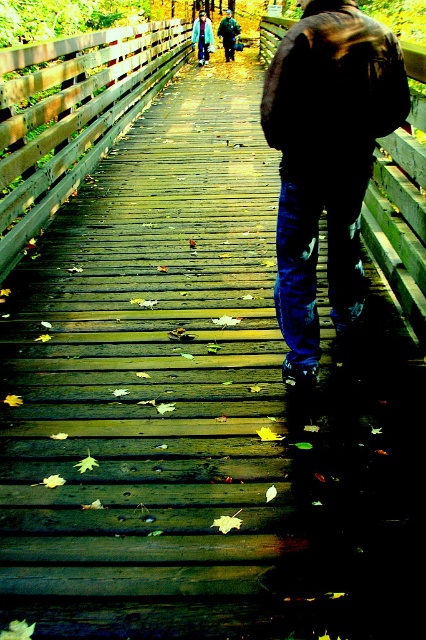
Question: Can you confirm if dark brown leather jacket at center is wider than brushed metal jacket at upper center?

Choices:
 (A) yes
 (B) no

Answer: (B)

Question: Which point is farther to the camera?

Choices:
 (A) brushed metal jacket at upper center
 (B) light blue denim jacket at upper center

Answer: (A)

Question: Which point is closer to the camera?

Choices:
 (A) (310, 182)
 (B) (221, 20)
 (C) (199, 35)

Answer: (A)

Question: Among these objects, which one is nearest to the camera?

Choices:
 (A) brushed metal jacket at upper center
 (B) light blue denim jacket at upper center
 (C) dark brown leather jacket at center

Answer: (C)

Question: Does dark brown leather jacket at center have a lesser width compared to light blue denim jacket at upper center?

Choices:
 (A) no
 (B) yes

Answer: (B)

Question: Can you confirm if light blue denim jacket at upper center is smaller than brushed metal jacket at upper center?

Choices:
 (A) no
 (B) yes

Answer: (A)